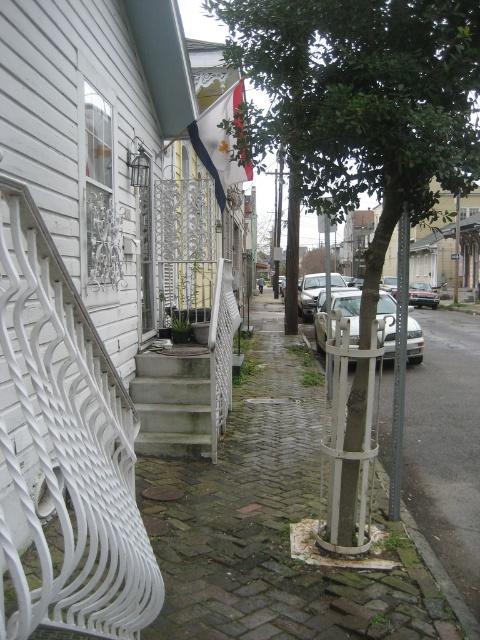
Is green textured tree at center taller than white wrought iron bench at left?

In fact, green textured tree at center may be shorter than white wrought iron bench at left.

Is green textured tree at center below white wrought iron bench at left?

Incorrect, green textured tree at center is not positioned below white wrought iron bench at left.

The height and width of the screenshot is (640, 480). What do you see at coordinates (363, 100) in the screenshot? I see `green textured tree at center` at bounding box center [363, 100].

Find the location of a particular element. green textured tree at center is located at coordinates (363, 100).

Can you confirm if white fabric flag at upper center is positioned below silver metallic car at center?

No.

Identify the location of white fabric flag at upper center. (220, 141).

Is green textured tree at center closer to the viewer compared to metallic gray pole at right?

Yes, green textured tree at center is in front of metallic gray pole at right.

Image resolution: width=480 pixels, height=640 pixels. I want to click on green textured tree at center, so click(x=363, y=100).